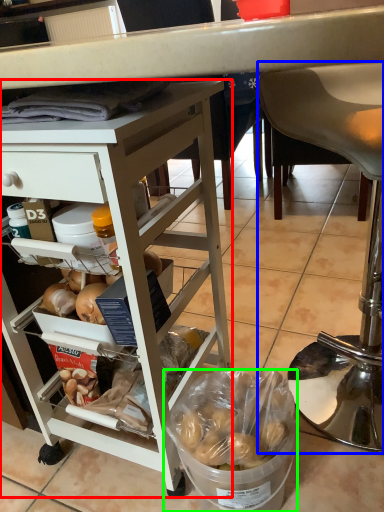
Question: Which is farther away from desk (highlighted by a red box)? chair (highlighted by a blue box) or bowl (highlighted by a green box)?

Choices:
 (A) chair
 (B) bowl

Answer: (A)